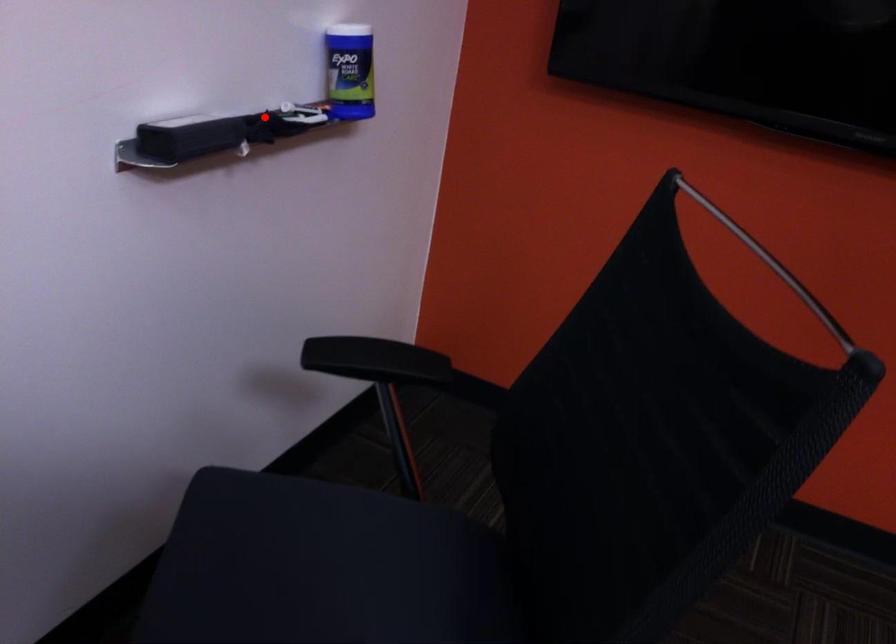
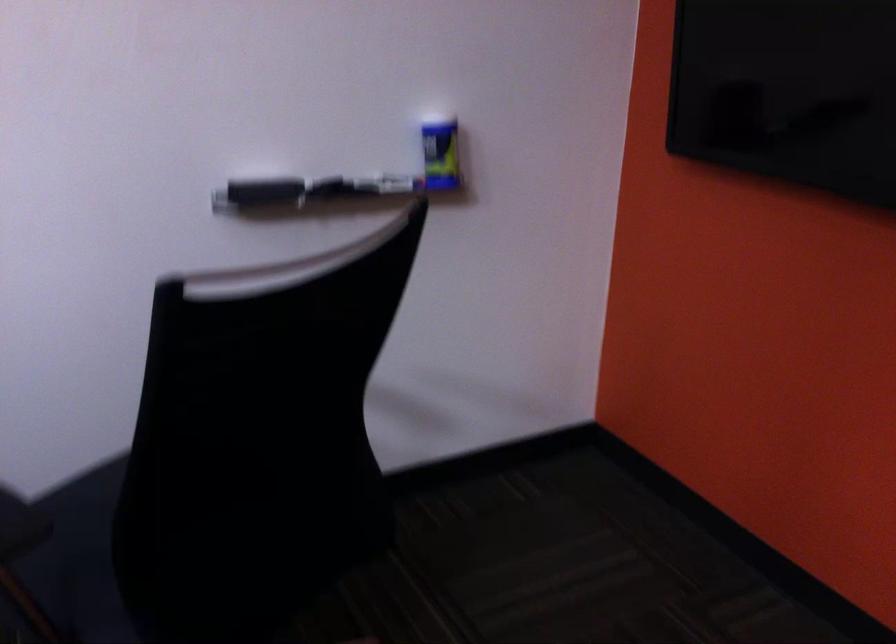
Question: I am providing you with two images of the same scene from different viewpoints. A red point is marked on the first image. At the location where the point appears in image 1, is it still visible in image 2?

Choices:
 (A) Yes
 (B) No

Answer: (A)